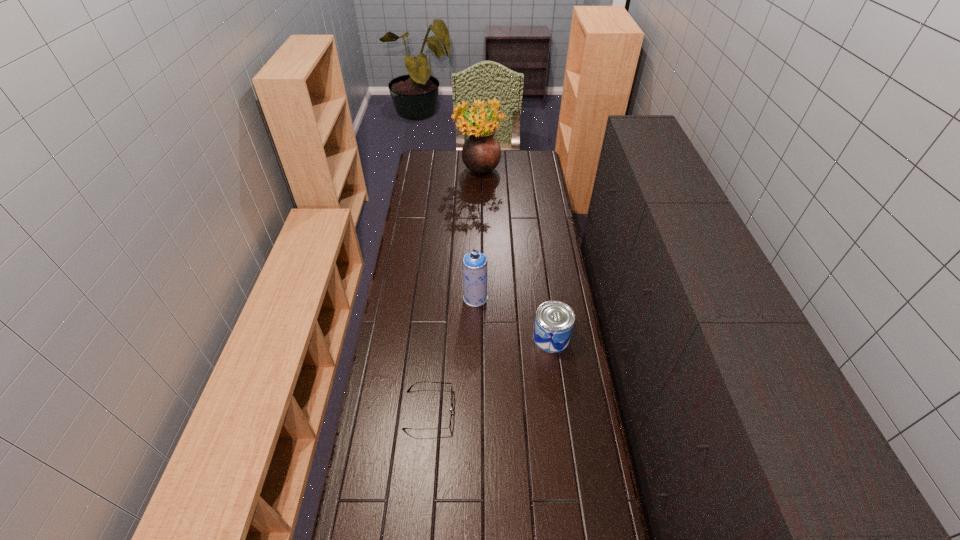
Image resolution: width=960 pixels, height=540 pixels. Find the location of `object that is the third nearest to the farthest object`. object that is the third nearest to the farthest object is located at coordinates (418, 382).

Where is `free spot that satisfies the following two spatial constraints: 1. on the back side of the flower arrangement; 2. on the right side of the second farthest object`? Image resolution: width=960 pixels, height=540 pixels. free spot that satisfies the following two spatial constraints: 1. on the back side of the flower arrangement; 2. on the right side of the second farthest object is located at coordinates (476, 173).